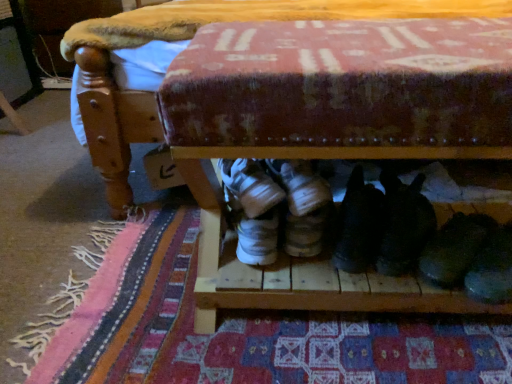
Question: Should I look upward or downward to see black suede shoes at center, the second footwear when ordered from left to right?

Choices:
 (A) up
 (B) down

Answer: (B)

Question: Can you confirm if white suede sneakers at center, marked as the fourth footwear in a right-to-left arrangement, is bigger than patterned fabric mat at lower center?

Choices:
 (A) no
 (B) yes

Answer: (A)

Question: Is white suede sneakers at center, marked as the fourth footwear in a right-to-left arrangement, positioned far away from patterned fabric mat at lower center?

Choices:
 (A) no
 (B) yes

Answer: (A)

Question: Is white suede sneakers at center, the 1th footwear from the left, to the right of patterned fabric mat at lower center from the viewer's perspective?

Choices:
 (A) no
 (B) yes

Answer: (A)

Question: Can you confirm if white suede sneakers at center, the 1th footwear from the left, is smaller than patterned fabric mat at lower center?

Choices:
 (A) yes
 (B) no

Answer: (A)

Question: Considering the relative positions of white suede sneakers at center, marked as the fourth footwear in a right-to-left arrangement, and patterned fabric mat at lower center in the image provided, is white suede sneakers at center, marked as the fourth footwear in a right-to-left arrangement, behind patterned fabric mat at lower center?

Choices:
 (A) yes
 (B) no

Answer: (A)

Question: From the image's perspective, would you say white suede sneakers at center, marked as the fourth footwear in a right-to-left arrangement, is positioned over patterned fabric mat at lower center?

Choices:
 (A) no
 (B) yes

Answer: (B)

Question: From the image's perspective, is black suede shoes at lower right, the second footwear in the right-to-left sequence, above black suede shoes at center, which is counted as the 3th footwear, starting from the right?

Choices:
 (A) no
 (B) yes

Answer: (B)

Question: Is black suede shoes at lower right, the third footwear in the left-to-right sequence, positioned behind black suede shoes at center, the second footwear when ordered from left to right?

Choices:
 (A) no
 (B) yes

Answer: (B)

Question: Does black suede shoes at lower right, the third footwear in the left-to-right sequence, have a greater height compared to black suede shoes at center, which is counted as the 3th footwear, starting from the right?

Choices:
 (A) yes
 (B) no

Answer: (B)

Question: Considering the relative positions of black suede shoes at lower right, the third footwear in the left-to-right sequence, and black suede shoes at center, which is counted as the 3th footwear, starting from the right, in the image provided, is black suede shoes at lower right, the third footwear in the left-to-right sequence, to the right of black suede shoes at center, which is counted as the 3th footwear, starting from the right, from the viewer's perspective?

Choices:
 (A) yes
 (B) no

Answer: (A)

Question: Is there a large distance between black suede shoes at lower right, the second footwear in the right-to-left sequence, and black suede shoes at center, which is counted as the 3th footwear, starting from the right?

Choices:
 (A) no
 (B) yes

Answer: (A)

Question: Is black suede shoes at center, the second footwear when ordered from left to right, at the back of black suede shoes at lower right, the second footwear in the right-to-left sequence?

Choices:
 (A) yes
 (B) no

Answer: (B)

Question: Can you confirm if black suede shoes at center, which is counted as the 3th footwear, starting from the right, is positioned to the left of white suede sneakers at center, marked as the fourth footwear in a right-to-left arrangement?

Choices:
 (A) no
 (B) yes

Answer: (A)